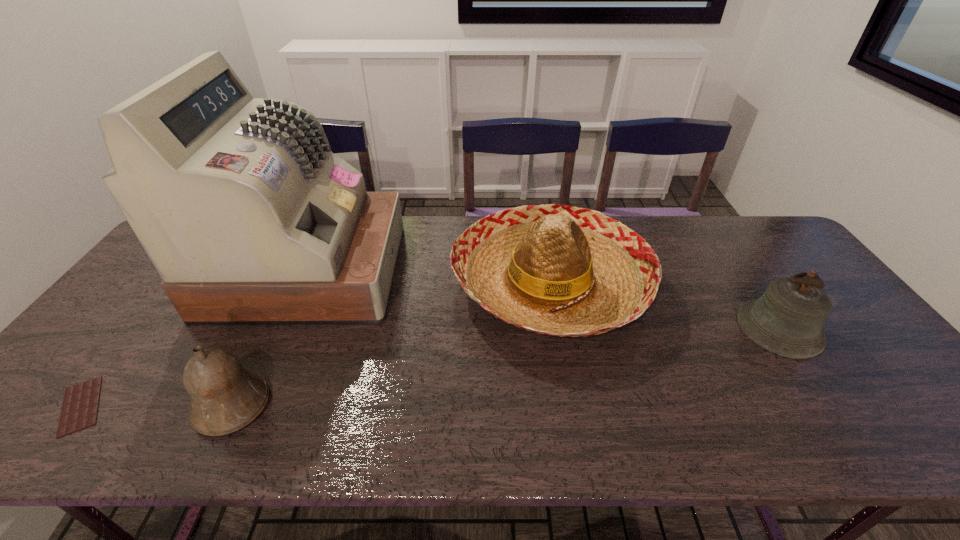
Locate an element on the screen. The image size is (960, 540). cash register is located at coordinates (249, 218).

The image size is (960, 540). Find the location of `sombrero`. sombrero is located at coordinates (552, 269).

At what (x,y) coordinates should I click in order to perform the action: click on the right bell. Please return your answer as a coordinate pair (x, y). Looking at the image, I should click on (787, 319).

Locate an element on the screen. Image resolution: width=960 pixels, height=540 pixels. the rightmost object is located at coordinates (787, 319).

The height and width of the screenshot is (540, 960). Identify the location of the left bell. (225, 397).

Image resolution: width=960 pixels, height=540 pixels. I want to click on the shortest object, so click(80, 405).

In order to click on chocolate bar in this screenshot , I will do `click(80, 405)`.

Where is `free space located 0.240m on the operating side of the tallest object`? The height and width of the screenshot is (540, 960). free space located 0.240m on the operating side of the tallest object is located at coordinates (475, 271).

This screenshot has height=540, width=960. Find the location of `vacant area located 0.180m on the front of the fourth object from left to right`. vacant area located 0.180m on the front of the fourth object from left to right is located at coordinates (576, 428).

This screenshot has height=540, width=960. What are the coordinates of `vacant area situated 0.080m on the right of the rightmost object` in the screenshot? It's located at (850, 328).